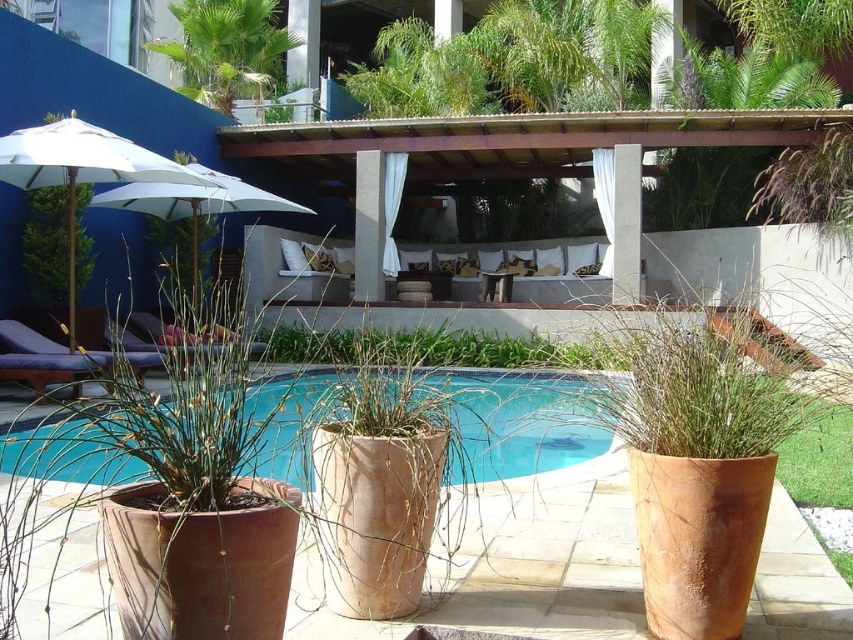
You are standing at the entrance of the resort and want to locate the blue ceramic swimming pool at center. According to the coordinates provided, where should you look to find it?

The blue ceramic swimming pool at center is located at coordinates point (x=515, y=422).

You are designing a new layout for the resort and need to place a new bench between the blue ceramic swimming pool at center and the white concrete pillar at center. Given that the bench requires 2 meters of space, can you determine if there is enough space between them based on their sizes?

The blue ceramic swimming pool at center is larger than the white concrete pillar at center, but the exact distance between them isn